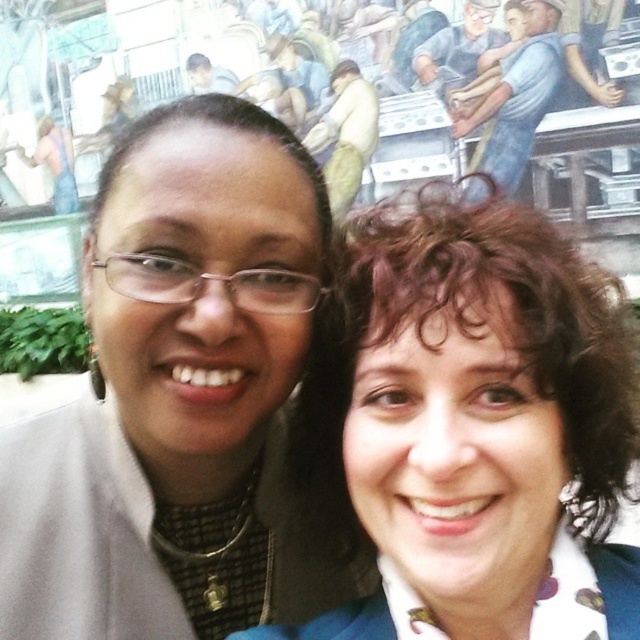
Question: Is matte black jacket at left above curly brown hair at center?

Choices:
 (A) no
 (B) yes

Answer: (B)

Question: Estimate the real-world distances between objects in this image. Which object is closer to the curly brown hair at center?

Choices:
 (A) matte black jacket at left
 (B) blue fabric shirt at upper right

Answer: (A)

Question: Considering the real-world distances, which object is farthest from the curly brown hair at center?

Choices:
 (A) blue fabric shirt at upper right
 (B) matte black jacket at left

Answer: (A)

Question: Is matte black jacket at left below blue fabric shirt at upper right?

Choices:
 (A) yes
 (B) no

Answer: (A)

Question: Is matte black jacket at left thinner than curly brown hair at center?

Choices:
 (A) no
 (B) yes

Answer: (B)

Question: Among these objects, which one is nearest to the camera?

Choices:
 (A) matte black jacket at left
 (B) curly brown hair at center

Answer: (B)